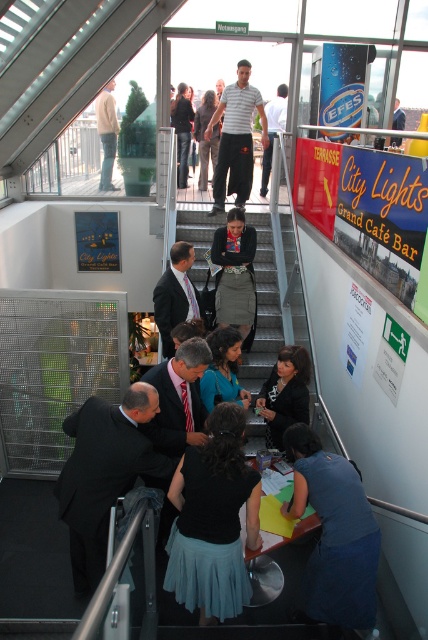
Question: Which object appears farthest from the camera in this image?

Choices:
 (A) black leather jacket at center
 (B) matte black suit at center
 (C) striped shirt at upper center

Answer: (C)

Question: Can you confirm if black matte skirt at center is thinner than blue fabric dress at center?

Choices:
 (A) yes
 (B) no

Answer: (B)

Question: Does black matte skirt at center have a larger size compared to striped shirt at upper center?

Choices:
 (A) no
 (B) yes

Answer: (A)

Question: Which object is positioned farthest from the striped cotton shirt at upper center?

Choices:
 (A) light brown leather jacket at upper center
 (B) black matte skirt at center

Answer: (B)

Question: Is striped cotton shirt at upper center below light blue shirt at center?

Choices:
 (A) yes
 (B) no

Answer: (A)

Question: Among these objects, which one is nearest to the camera?

Choices:
 (A) dark gray skirt at center
 (B) blue fabric dress at center

Answer: (B)